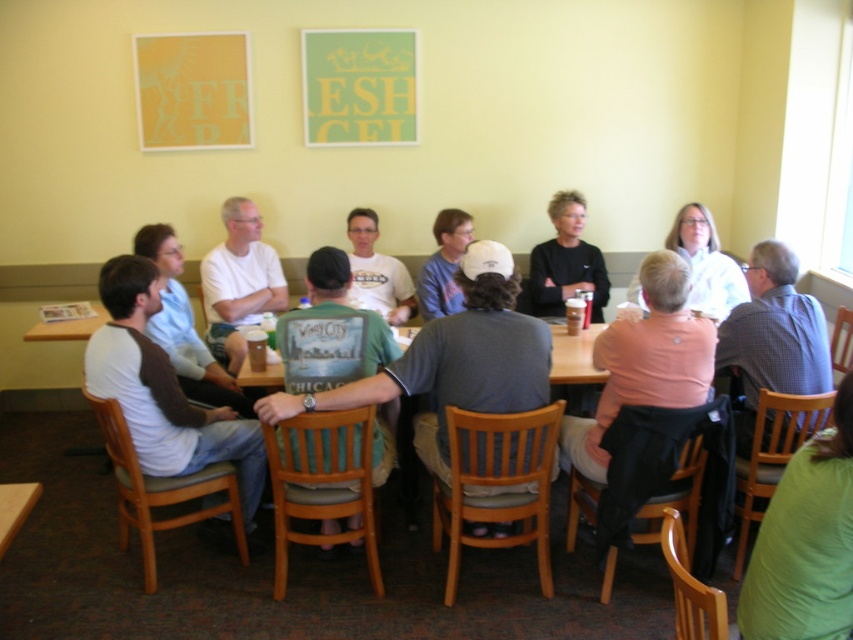
Measure the distance between point (x=128, y=403) and camera.

A distance of 8.68 feet exists between point (x=128, y=403) and camera.

Can you confirm if white cotton shirt at left is positioned below black matte shirt at center?

Indeed, white cotton shirt at left is positioned under black matte shirt at center.

Is point (109, 339) more distant than point (584, 241)?

No, (109, 339) is closer to viewer.

Find the location of a particular element. white cotton shirt at left is located at coordinates (164, 392).

Between green cotton t-shirt at center and white matte shirt at upper center, which one has less height?

white matte shirt at upper center

Can you confirm if green cotton t-shirt at center is positioned to the left of white matte shirt at upper center?

Yes, green cotton t-shirt at center is to the left of white matte shirt at upper center.

What do you see at coordinates (341, 308) in the screenshot? I see `green cotton t-shirt at center` at bounding box center [341, 308].

You are a GUI agent. You are given a task and a screenshot of the screen. Output one action in this format:
    pyautogui.click(x=<x>, y=<y>)
    Task: Click on the green cotton t-shirt at center
    
    Given the screenshot: What is the action you would take?
    pyautogui.click(x=341, y=308)

Based on the photo, between white cotton shirt at left and green cotton t-shirt at center, which one is positioned lower?

white cotton shirt at left is lower down.

This screenshot has width=853, height=640. Describe the element at coordinates (164, 392) in the screenshot. I see `white cotton shirt at left` at that location.

Who is more distant from viewer, (x=128, y=282) or (x=273, y=403)?

The point (x=128, y=282) is behind.

Locate an element on the screen. This screenshot has width=853, height=640. white cotton shirt at left is located at coordinates (164, 392).